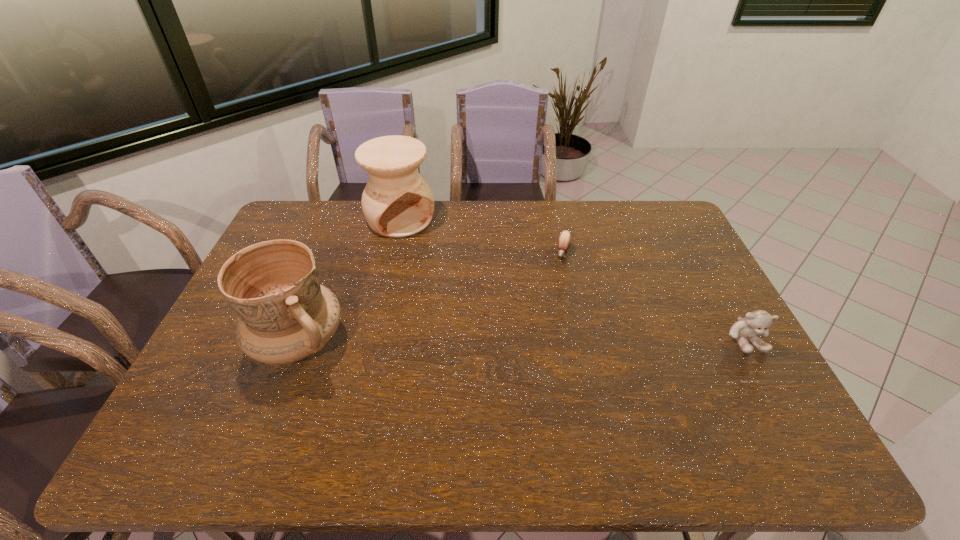
Identify the location of vacant space on the desktop that is between the nearer pottery and the second shortest object and is positioned at the open side of the farther pottery. (508, 341).

Locate an element on the screen. free spot on the desktop that is between the nearer pottery and the second shortest object and is positioned on the front-facing side of the shortest object is located at coordinates (537, 340).